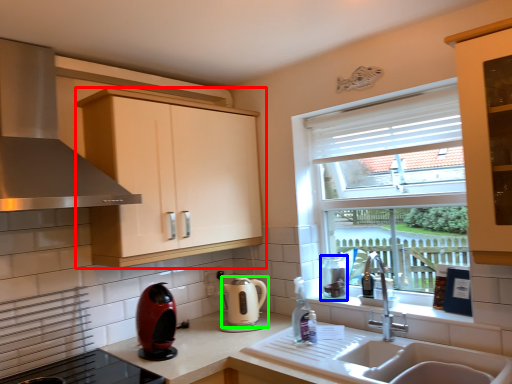
Question: Which is nearer to the cabinetry (highlighted by a red box)? appliance (highlighted by a blue box) or kitchen appliance (highlighted by a green box).

Choices:
 (A) appliance
 (B) kitchen appliance

Answer: (B)